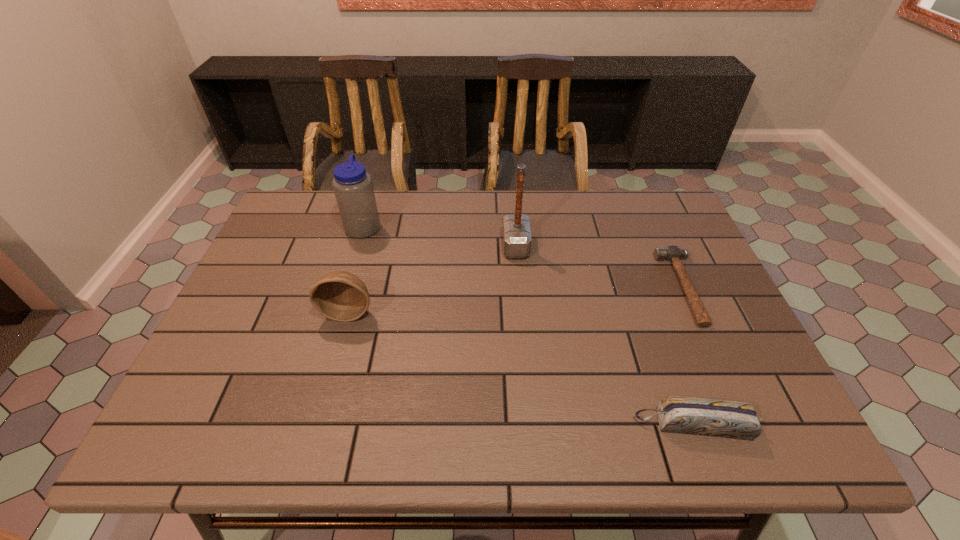
Where is `vacant region between the third object from left to right and the shorter hammer`? The image size is (960, 540). vacant region between the third object from left to right and the shorter hammer is located at coordinates (600, 267).

Where is `unoccupied area between the nearest object and the right hammer`? Image resolution: width=960 pixels, height=540 pixels. unoccupied area between the nearest object and the right hammer is located at coordinates [688, 356].

Locate an element on the screen. The image size is (960, 540). unoccupied area between the taller hammer and the shorter hammer is located at coordinates (600, 267).

Find the location of a particular element. This screenshot has width=960, height=540. vacant area between the nearest object and the bowl is located at coordinates (521, 368).

The width and height of the screenshot is (960, 540). In order to click on vacant area that lies between the right hammer and the third shortest object in this screenshot , I will do `click(516, 300)`.

Locate an element on the screen. The height and width of the screenshot is (540, 960). free space between the shortest object and the tallest object is located at coordinates (600, 267).

The height and width of the screenshot is (540, 960). What are the coordinates of `vacant area between the shorter hammer and the taller hammer` in the screenshot? It's located at pyautogui.click(x=600, y=267).

Where is `empty location between the third object from left to right and the shorter hammer`? Image resolution: width=960 pixels, height=540 pixels. empty location between the third object from left to right and the shorter hammer is located at coordinates click(600, 267).

This screenshot has height=540, width=960. I want to click on object that is the third nearest to the third shortest object, so click(730, 419).

Identify the location of object identified as the fourth closest to the shorter hammer. Image resolution: width=960 pixels, height=540 pixels. (352, 185).